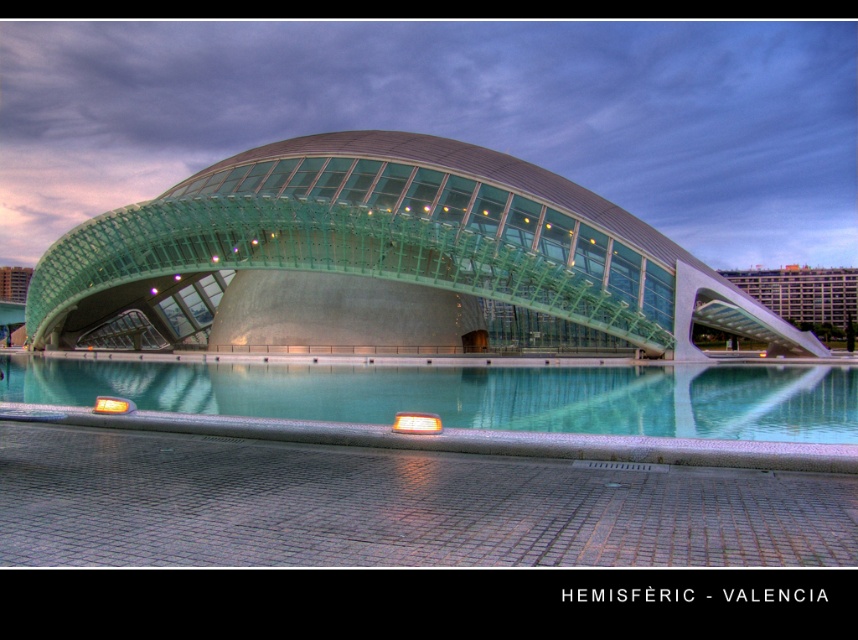
Question: Is transparent glass dome at center wider than green glass building at right?

Choices:
 (A) no
 (B) yes

Answer: (B)

Question: Which point is farther from the camera taking this photo?

Choices:
 (A) (802, 321)
 (B) (63, 400)

Answer: (A)

Question: Which point appears farthest from the camera in this image?

Choices:
 (A) (444, 237)
 (B) (826, 336)
 (C) (508, 426)

Answer: (B)

Question: Among these points, which one is farthest from the camera?

Choices:
 (A) (813, 428)
 (B) (847, 291)

Answer: (B)

Question: Is transparent glass dome at center positioned in front of clear glass water at center?

Choices:
 (A) yes
 (B) no

Answer: (B)

Question: Is transparent glass dome at center further to camera compared to clear glass water at center?

Choices:
 (A) no
 (B) yes

Answer: (B)